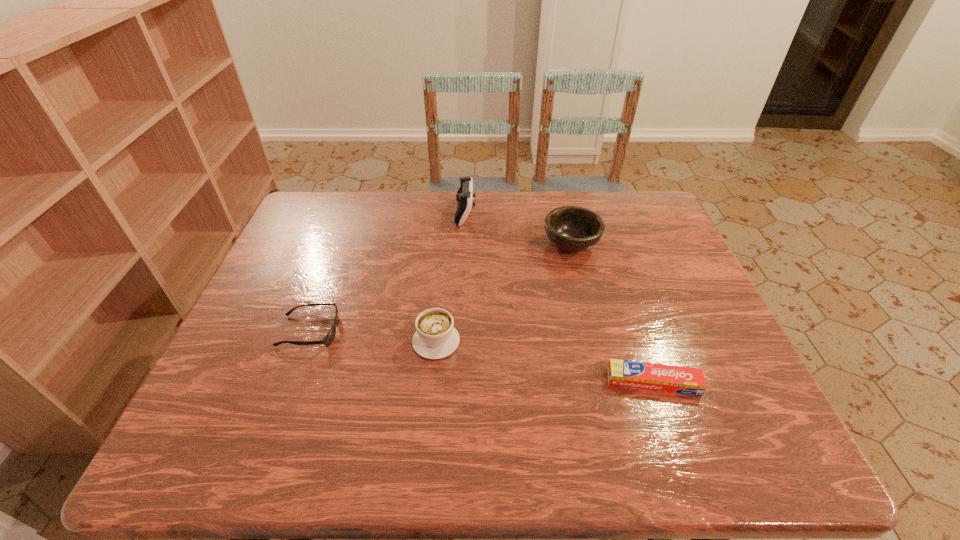
You are a GUI agent. You are given a task and a screenshot of the screen. Output one action in this format:
    pyautogui.click(x=<x>, y=<y>)
    Task: Click on the unoccupied position between the bowl and the leftmost object
    This screenshot has height=540, width=960.
    Given the screenshot: What is the action you would take?
    pyautogui.click(x=441, y=288)

At what (x,y) coordinates should I click in order to perform the action: click on object that can be found as the fourth closest to the bowl. Please return your answer as a coordinate pair (x, y). The width and height of the screenshot is (960, 540). Looking at the image, I should click on (328, 339).

At what (x,y) coordinates should I click in order to perform the action: click on object that is the closest one to the toothpaste. Please return your answer as a coordinate pair (x, y). Looking at the image, I should click on (435, 337).

The width and height of the screenshot is (960, 540). In order to click on vacant space that satisfies the following two spatial constraints: 1. on the front-facing side of the nearest object; 2. on the left side of the control in this screenshot , I will do `click(458, 382)`.

Find the location of `vacant position in the image that satisfies the following two spatial constraints: 1. on the front-facing side of the control; 2. on the left side of the toothpaste`. vacant position in the image that satisfies the following two spatial constraints: 1. on the front-facing side of the control; 2. on the left side of the toothpaste is located at coordinates (458, 382).

This screenshot has width=960, height=540. What are the coordinates of `free space that satisfies the following two spatial constraints: 1. to the right of the cappuccino's handle; 2. on the front-facing side of the leftmost object` in the screenshot? It's located at (437, 332).

Locate an element on the screen. The width and height of the screenshot is (960, 540). vacant area in the image that satisfies the following two spatial constraints: 1. on the front-facing side of the toothpaste; 2. on the right side of the tallest object is located at coordinates (458, 382).

Where is `vacant region that satisfies the following two spatial constraints: 1. on the front-facing side of the bowl; 2. on the right side of the tallest object`? vacant region that satisfies the following two spatial constraints: 1. on the front-facing side of the bowl; 2. on the right side of the tallest object is located at coordinates (464, 244).

Find the location of a particular element. vacant region that satisfies the following two spatial constraints: 1. to the right of the cappuccino's handle; 2. on the front-facing side of the leftmost object is located at coordinates (437, 332).